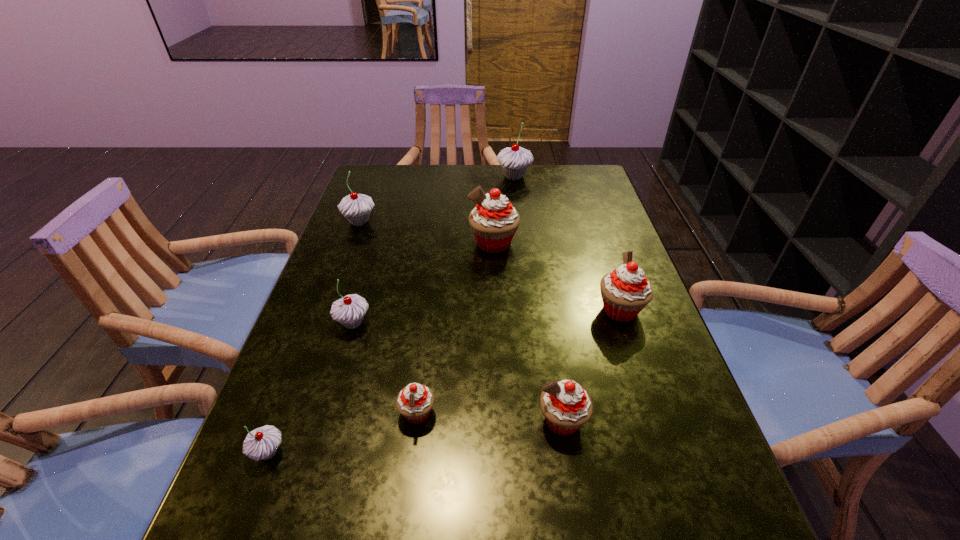
At what (x,y) coordinates should I click in order to perform the action: click on vacant space that is in between the third biggest pink cupcake and the rightmost object. Please return your answer as a coordinate pair (x, y). Looking at the image, I should click on (591, 365).

Where is `free area in between the farthest cupcake and the second nearest gray cupcake`? This screenshot has height=540, width=960. free area in between the farthest cupcake and the second nearest gray cupcake is located at coordinates point(434,249).

Locate an element on the screen. blank region between the nearest gray cupcake and the third biggest pink cupcake is located at coordinates (415, 436).

Point out which object is positioned as the fifth nearest to the third farthest gray cupcake. Please provide its 2D coordinates. Your answer should be formatted as a tuple, i.e. [(x, y)], where the tuple contains the x and y coordinates of a point satisfying the conditions above.

[(566, 406)]

The image size is (960, 540). I want to click on object that is the fourth nearest to the second smallest gray cupcake, so click(355, 207).

What are the coordinates of `cupcake that stands as the third closest to the farthest gray cupcake` in the screenshot? It's located at (625, 292).

Locate an element on the screen. the second closest cupcake to the third biggest pink cupcake is located at coordinates (625, 292).

Locate which gray cupcake ranks second in proximity to the third nearest gray cupcake. Please provide its 2D coordinates. Your answer should be formatted as a tuple, i.e. [(x, y)], where the tuple contains the x and y coordinates of a point satisfying the conditions above.

[(515, 160)]

At what (x,y) coordinates should I click in order to perform the action: click on gray cupcake that can be found as the closest to the third smallest pink cupcake. Please return your answer as a coordinate pair (x, y). This screenshot has height=540, width=960. Looking at the image, I should click on point(349,311).

This screenshot has width=960, height=540. In order to click on the second closest pink cupcake to the second farthest gray cupcake in this screenshot , I will do `click(415, 401)`.